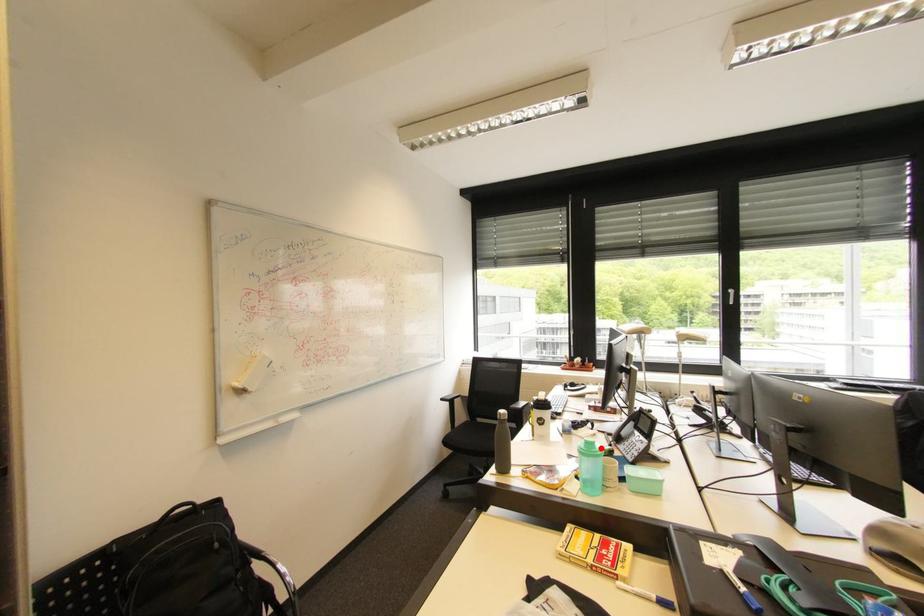
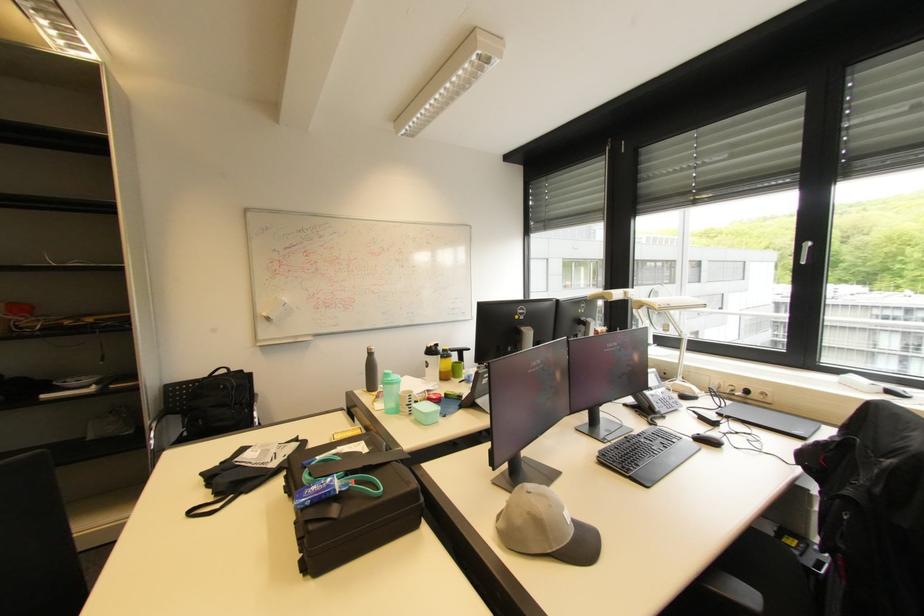
Where in the second image is the point corresponding to the highlighted location from the first image?

(394, 379)